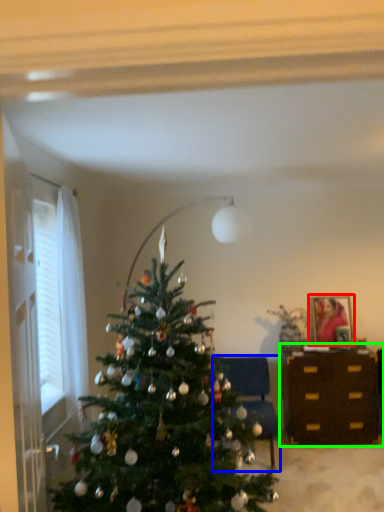
Question: Which object is the closest to the picture frame (highlighted by a red box)? Choose among these: furniture (highlighted by a blue box) or desk (highlighted by a green box).

Choices:
 (A) furniture
 (B) desk

Answer: (B)